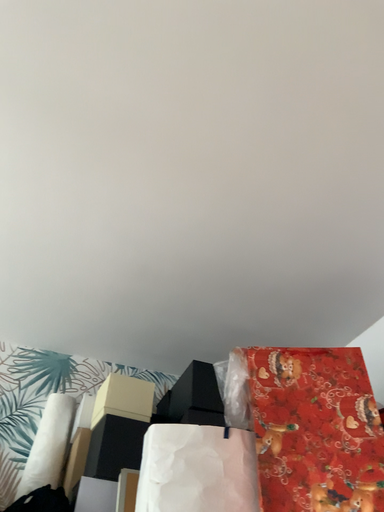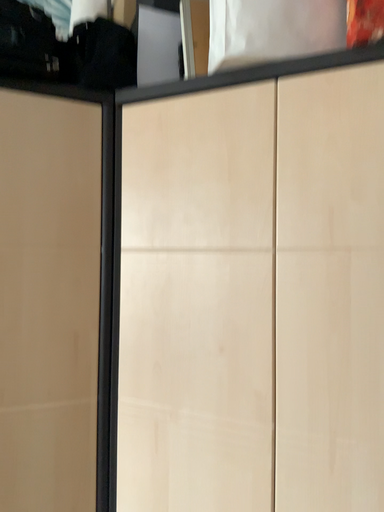
Question: How did the camera likely rotate when shooting the video?

Choices:
 (A) rotated upward
 (B) rotated downward

Answer: (B)